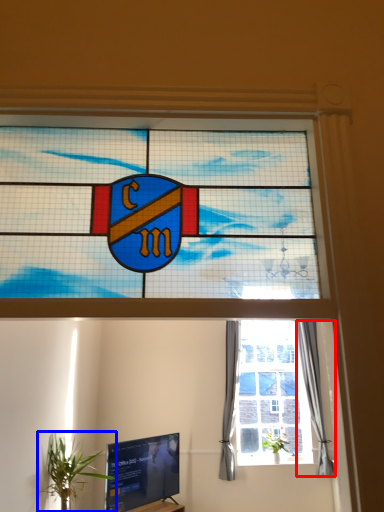
Question: Which point is closer to the camera, curtain (highlighted by a red box) or houseplant (highlighted by a blue box)?

Choices:
 (A) curtain
 (B) houseplant

Answer: (B)